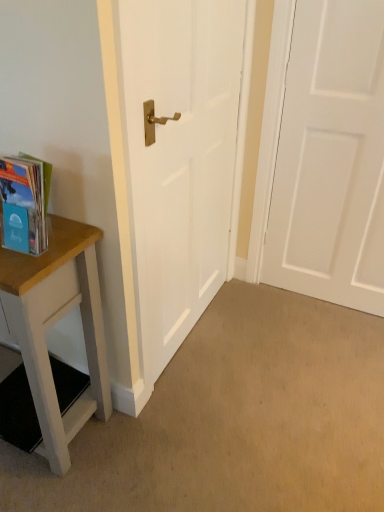
At what (x,y) coordinates should I click in order to perform the action: click on free space to the left of white matte door at right, which appears as the second door when viewed from the left. Please return your answer as a coordinate pair (x, y). Looking at the image, I should click on (262, 317).